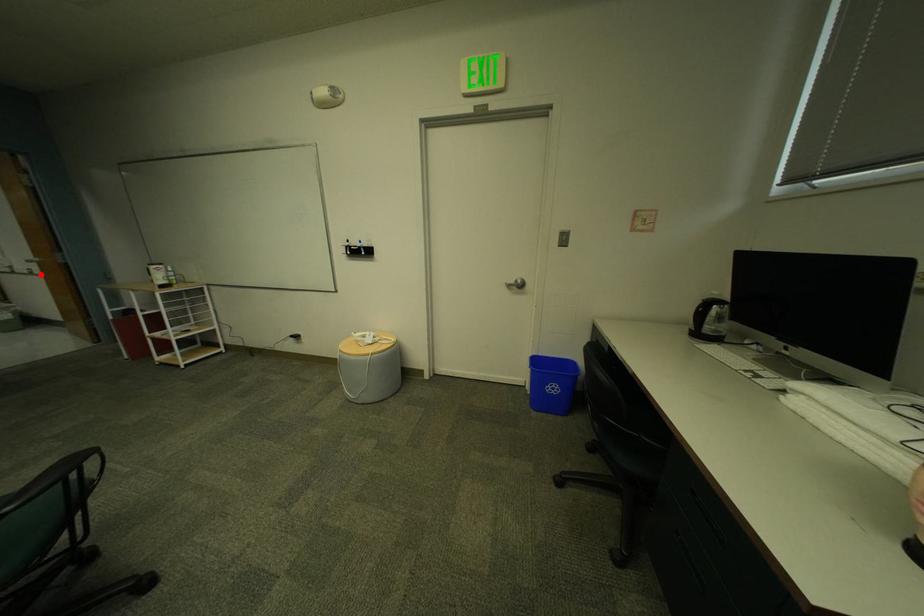
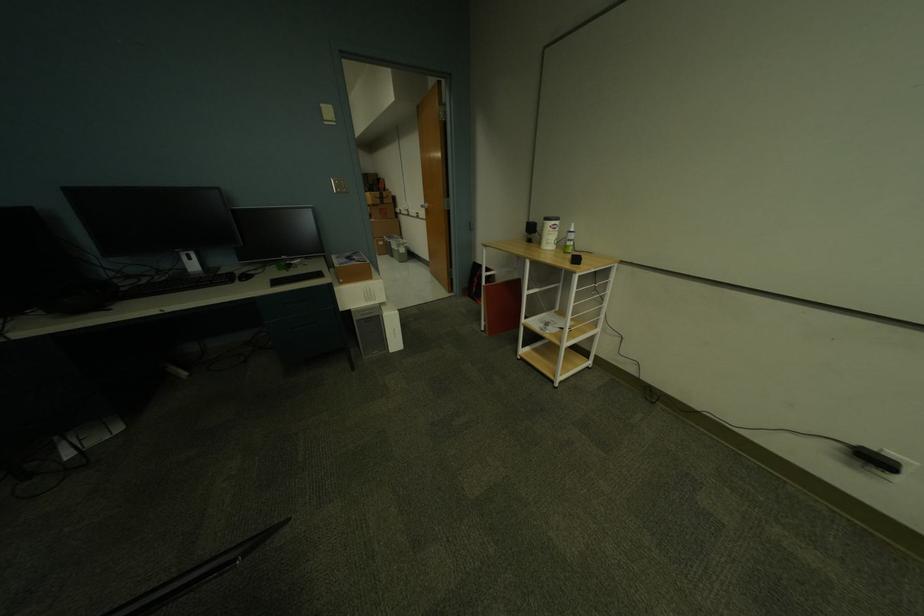
Find the pixel in the second image that matches the highlighted location in the first image.

(427, 217)